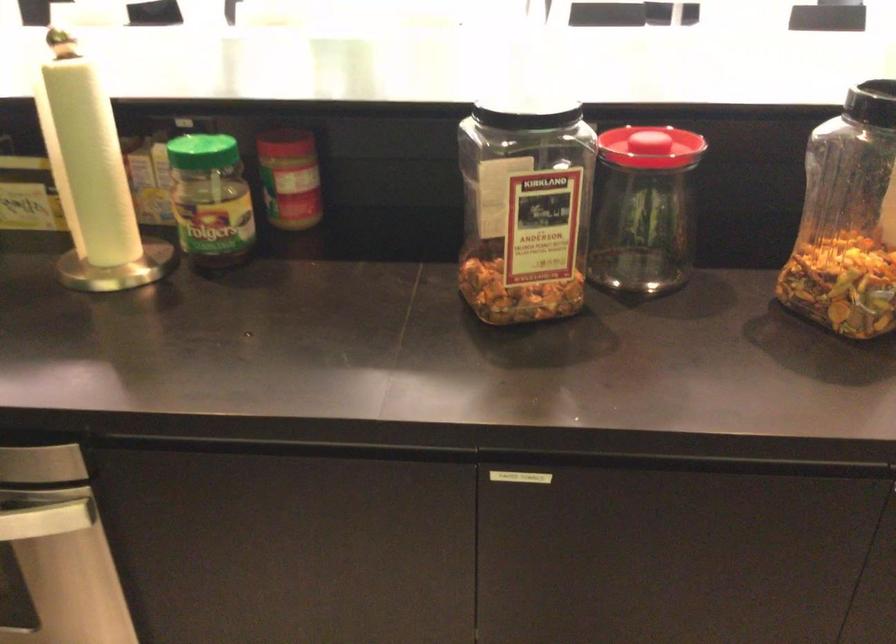
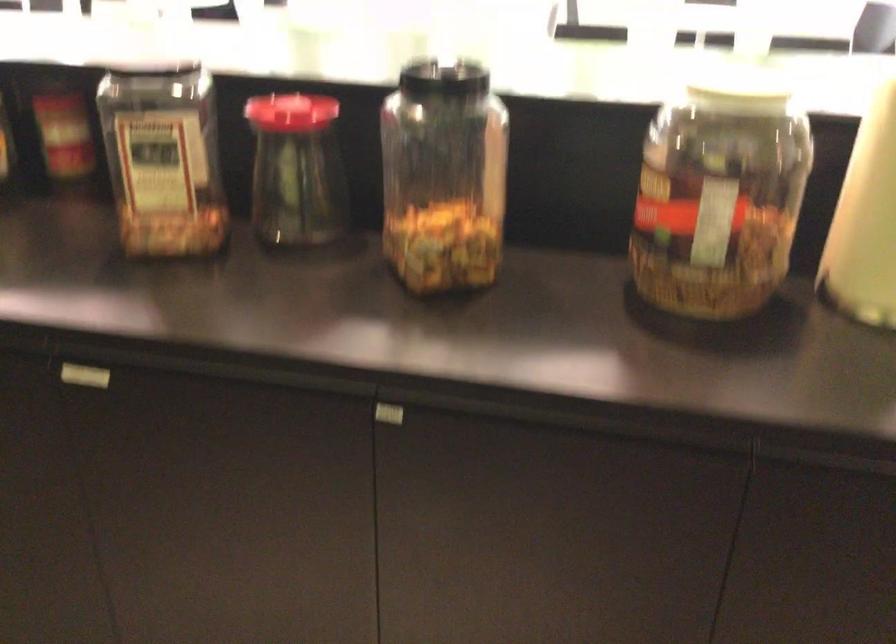
Where in the second image is the point corresponding to point (504, 478) from the first image?

(84, 375)